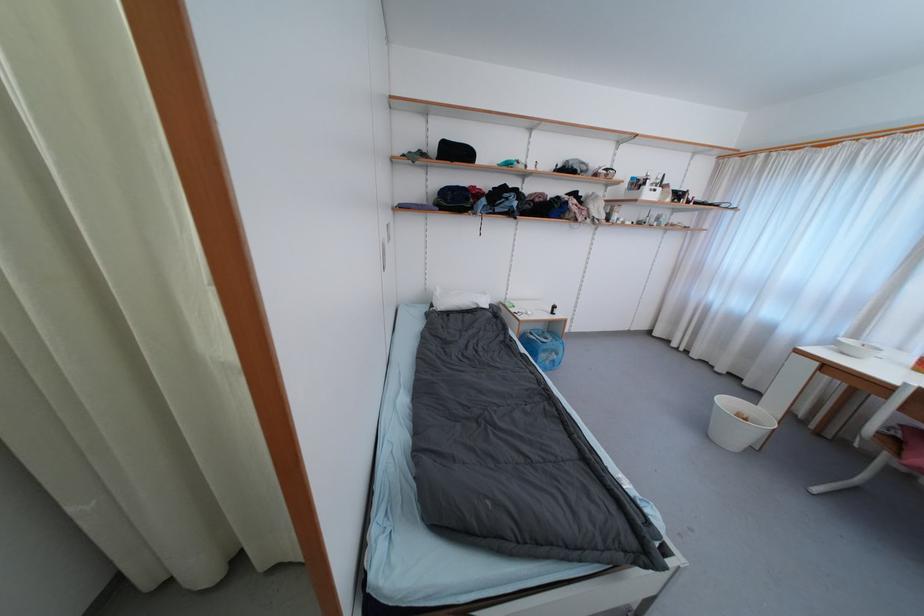
Where is `white bowl`? white bowl is located at coordinates (737, 423).